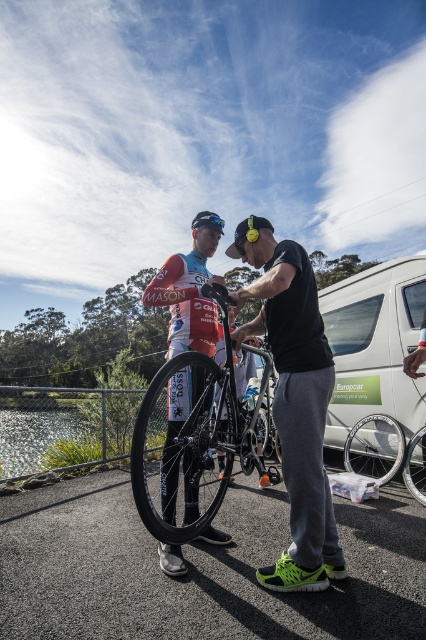
You are standing in the same position as the person on the right, who is working on the black matte bicycle at center. If you want to hand the matte black helmet at center to the person on the left, who is behind you, which direction should you turn?

You should turn towards the person on the left because the matte black helmet at center is behind you, closer to their position since it is farther from the viewer than the black matte bicycle at center.

You are a photographer setting up a tripod to take a photo of the black matte bicycle at center and the matte black helmet at center. If the bicycle is shorter than the helmet, which object should you position lower on the tripod to ensure both are in focus?

You should position the black matte bicycle at center lower on the tripod since it is shorter than the matte black helmet at center, ensuring both are in focus.